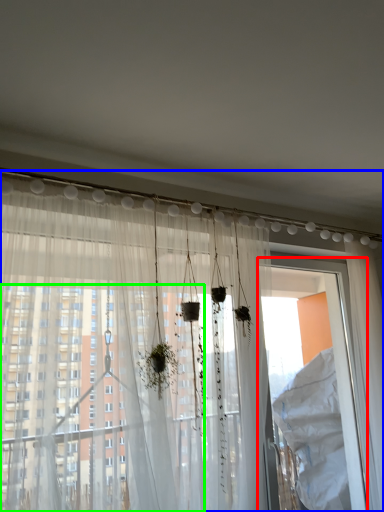
Question: Which object is the closest to the screen door (highlighted by a red box)? Choose among these: curtain (highlighted by a blue box) or window (highlighted by a green box).

Choices:
 (A) curtain
 (B) window

Answer: (A)